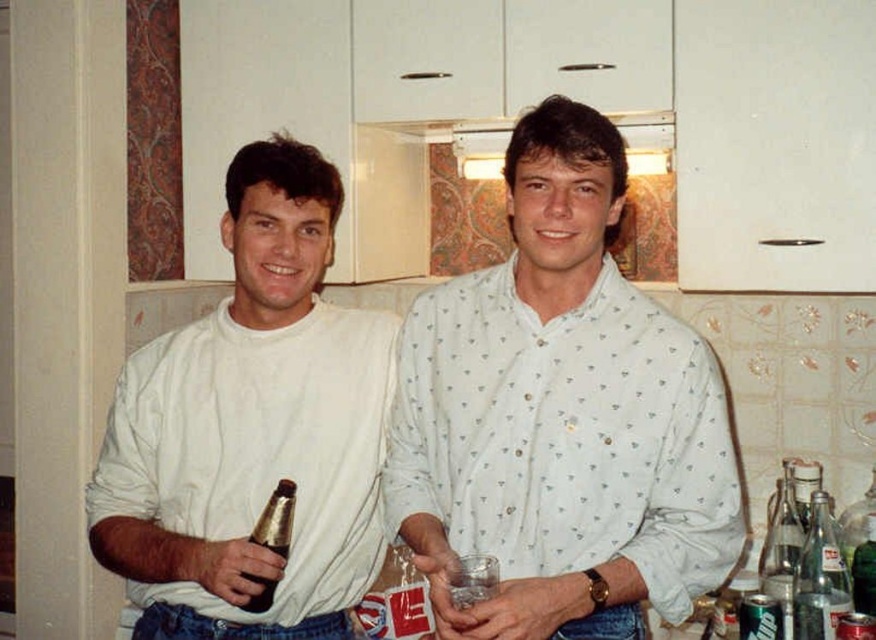
Question: Which of the following is the closest to the observer?

Choices:
 (A) clear glass soda bottle at right
 (B) brown glass bottle at lower left

Answer: (B)

Question: Estimate the real-world distances between objects in this image. Which object is farther from the white matte shirt at left?

Choices:
 (A) brown glass bottle at lower left
 (B) clear glass soda at right
 (C) white dotted shirt at center

Answer: (B)

Question: Among these objects, which one is nearest to the camera?

Choices:
 (A) brown glass bottle at lower left
 (B) clear glass soda bottle at right

Answer: (A)

Question: Can you confirm if clear glass soda bottle at right is positioned to the right of brown glass bottle at lower left?

Choices:
 (A) no
 (B) yes

Answer: (B)

Question: Is the position of white dotted shirt at center more distant than that of clear glass soda bottle at right?

Choices:
 (A) no
 (B) yes

Answer: (A)

Question: Does white matte shirt at left have a greater width compared to clear glass soda at right?

Choices:
 (A) yes
 (B) no

Answer: (A)